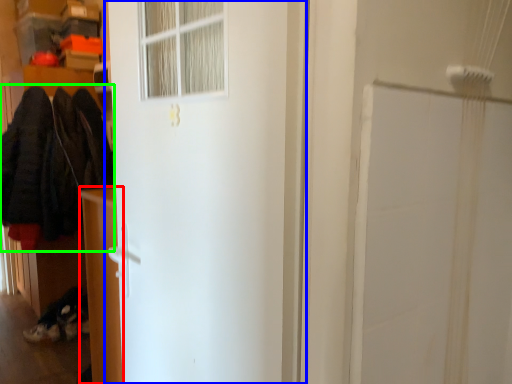
Question: Which object is the farthest from furniture (highlighted by a red box)? Choose among these: door (highlighted by a blue box) or clothing (highlighted by a green box).

Choices:
 (A) door
 (B) clothing

Answer: (B)